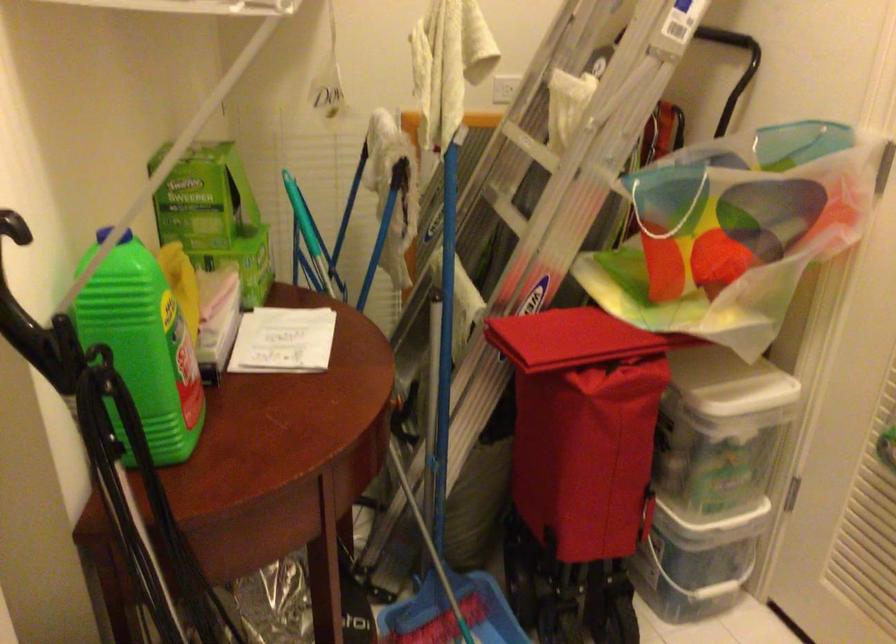
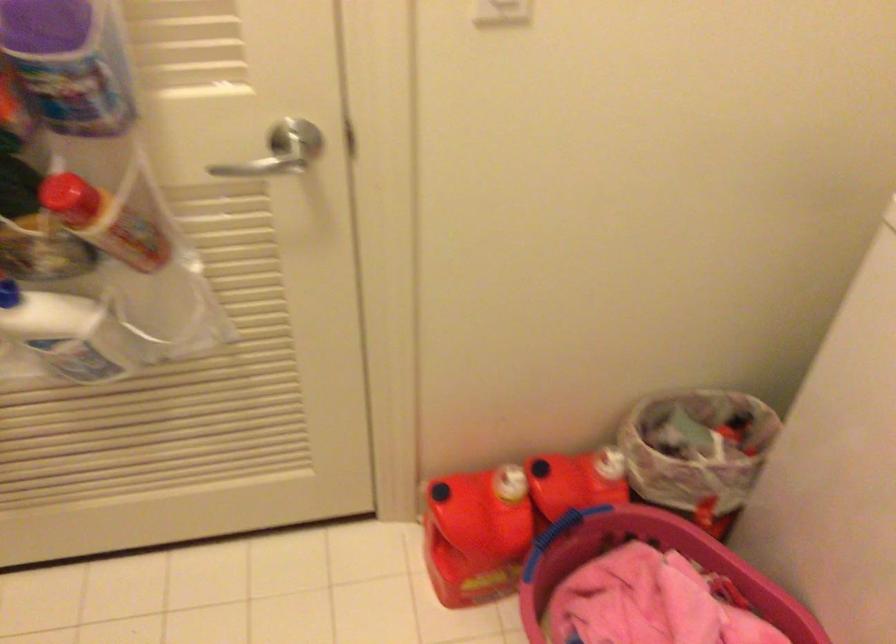
First-person continuous shooting, in which direction is the camera rotating?

The rotation direction of the camera is right-down.